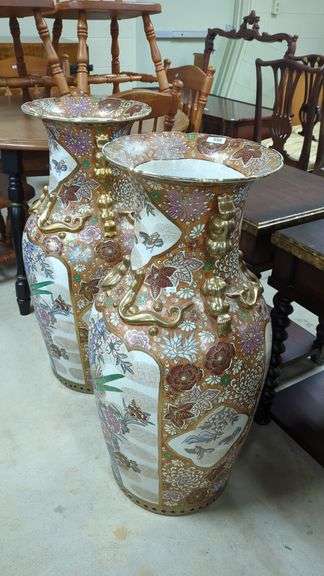
Where is `mirror`? This screenshot has width=324, height=576. mirror is located at coordinates (236, 64).